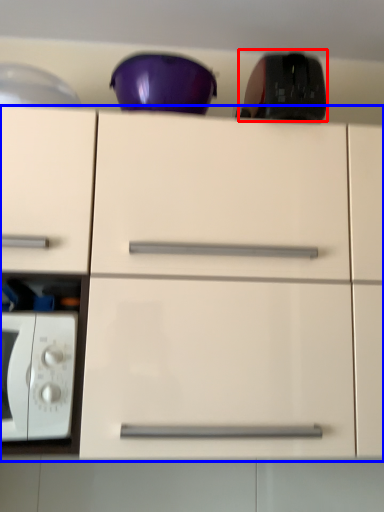
Question: Among these objects, which one is farthest to the camera, appliance (highlighted by a red box) or cabinetry (highlighted by a blue box)?

Choices:
 (A) appliance
 (B) cabinetry

Answer: (A)